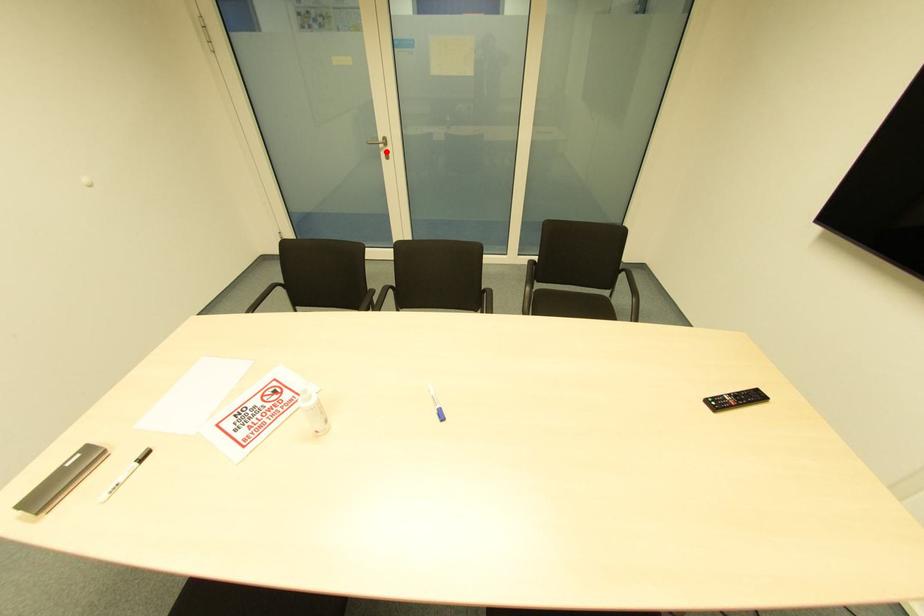
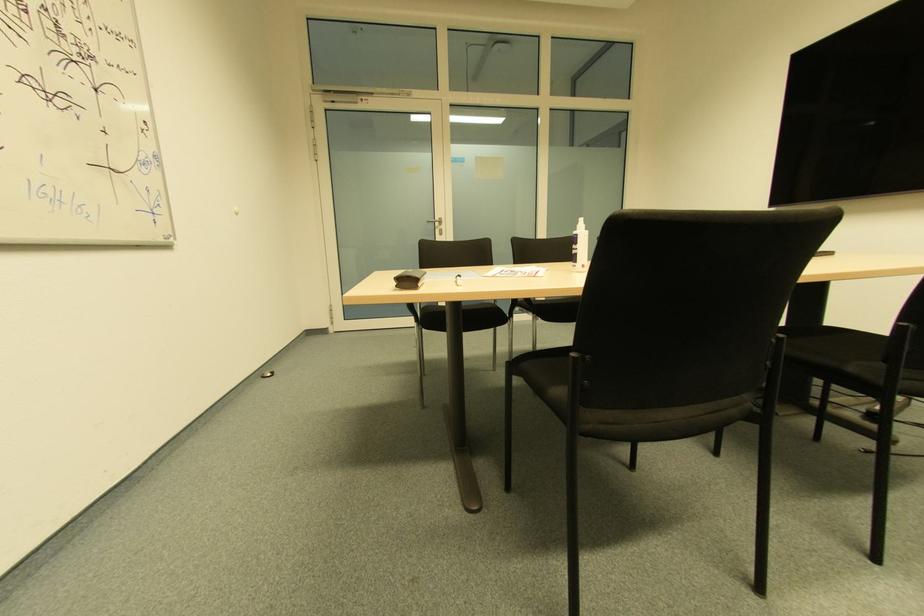
The point at the highlighted location is marked in the first image. Where is the corresponding point in the second image?

(440, 230)